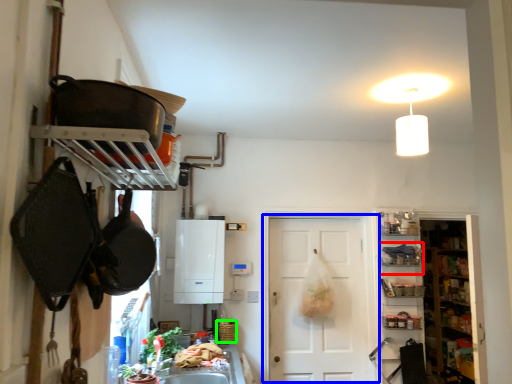
Question: Based on their relative distances, which object is nearer to shelf (highlighted by a red box)? Choose from door (highlighted by a blue box) and basket (highlighted by a green box).

Choices:
 (A) door
 (B) basket

Answer: (A)